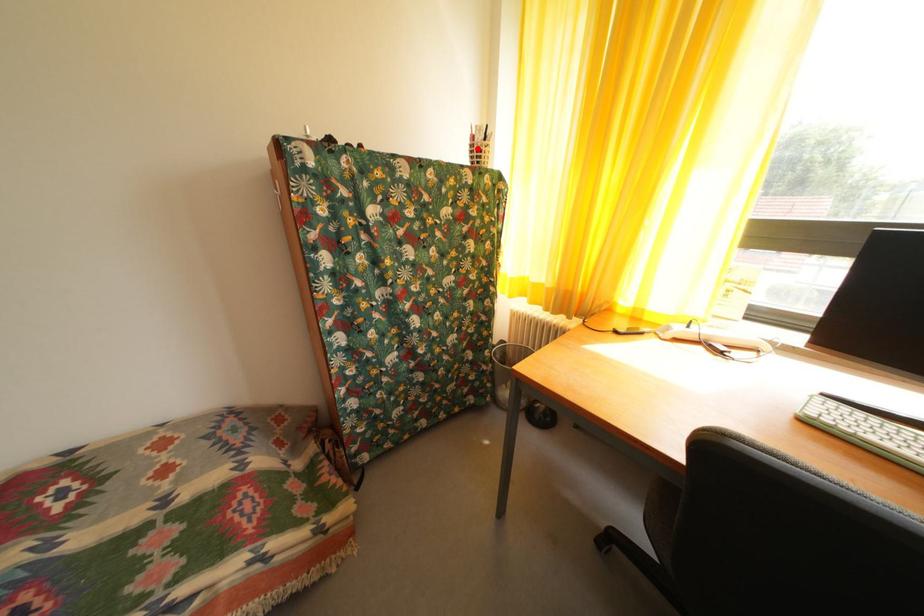
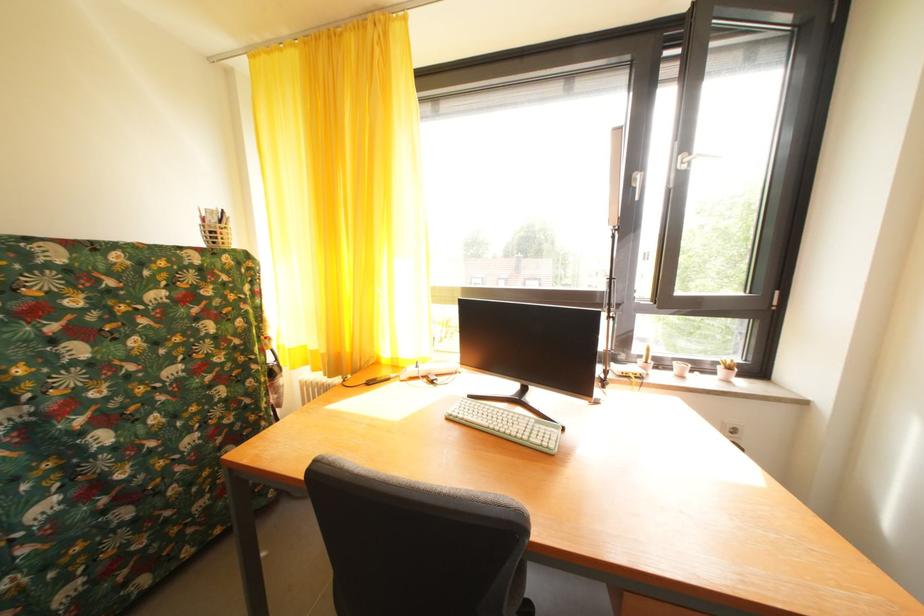
In the second image, find the point that corresponds to the highlighted location in the first image.

(209, 229)